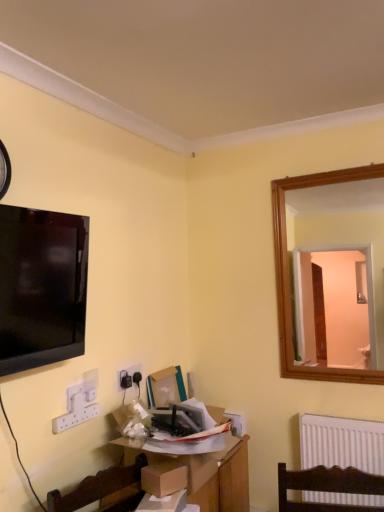
Question: Can you confirm if cardboard box at center is taller than black plastic clock at upper left?

Choices:
 (A) yes
 (B) no

Answer: (B)

Question: From a real-world perspective, is cardboard box at center below black plastic clock at upper left?

Choices:
 (A) yes
 (B) no

Answer: (A)

Question: Is the position of cardboard box at center less distant than that of black plastic clock at upper left?

Choices:
 (A) no
 (B) yes

Answer: (A)

Question: From the image's perspective, is cardboard box at center on black plastic clock at upper left?

Choices:
 (A) no
 (B) yes

Answer: (A)

Question: Is cardboard box at center next to black plastic clock at upper left and touching it?

Choices:
 (A) yes
 (B) no

Answer: (B)

Question: Could you tell me if cardboard box at center is turned towards black plastic clock at upper left?

Choices:
 (A) yes
 (B) no

Answer: (B)

Question: Can you confirm if matte black tv at upper left is smaller than brown cardboard box at center?

Choices:
 (A) yes
 (B) no

Answer: (B)

Question: Is matte black tv at upper left thinner than brown cardboard box at center?

Choices:
 (A) no
 (B) yes

Answer: (A)

Question: Is matte black tv at upper left beside brown cardboard box at center?

Choices:
 (A) no
 (B) yes

Answer: (A)

Question: Could you tell me if matte black tv at upper left is facing brown cardboard box at center?

Choices:
 (A) yes
 (B) no

Answer: (B)

Question: Is matte black tv at upper left not close to brown cardboard box at center?

Choices:
 (A) yes
 (B) no

Answer: (B)

Question: From the image's perspective, is matte black tv at upper left located above brown cardboard box at center?

Choices:
 (A) no
 (B) yes

Answer: (B)

Question: Considering the relative sizes of black plastic clock at upper left and wooden table at center in the image provided, is black plastic clock at upper left bigger than wooden table at center?

Choices:
 (A) no
 (B) yes

Answer: (A)